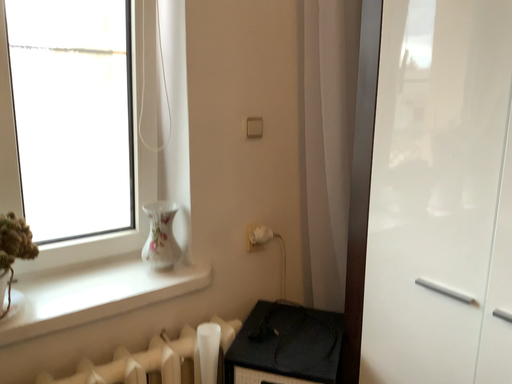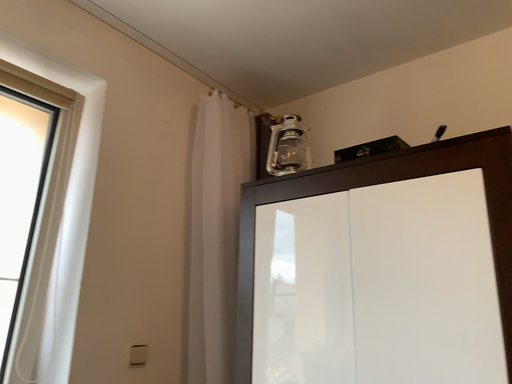
Question: Which way did the camera rotate in the video?

Choices:
 (A) rotated right
 (B) rotated left

Answer: (A)